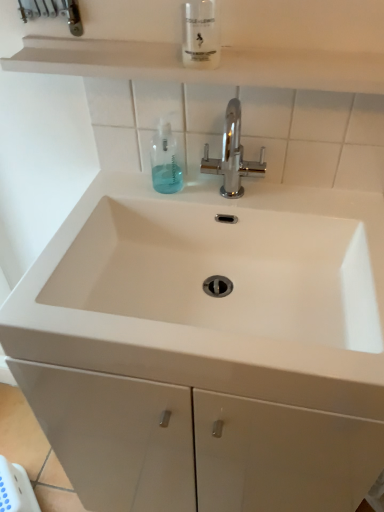
Question: Would you say chrome metallic faucet at center is outside clear plastic bottle at upper center, the second mouthwash viewed from the left?

Choices:
 (A) no
 (B) yes

Answer: (B)

Question: Considering the relative sizes of chrome metallic faucet at center and clear plastic bottle at upper center, the 2th mouthwash positioned from the back, in the image provided, is chrome metallic faucet at center smaller than clear plastic bottle at upper center, the 2th mouthwash positioned from the back,?

Choices:
 (A) yes
 (B) no

Answer: (B)

Question: Could you tell me if chrome metallic faucet at center is facing clear plastic bottle at upper center, which is the 2th mouthwash from bottom to top?

Choices:
 (A) no
 (B) yes

Answer: (A)

Question: Considering the relative sizes of chrome metallic faucet at center and clear plastic bottle at upper center, which is the 2th mouthwash from bottom to top, in the image provided, is chrome metallic faucet at center bigger than clear plastic bottle at upper center, which is the 2th mouthwash from bottom to top,?

Choices:
 (A) yes
 (B) no

Answer: (A)

Question: Does chrome metallic faucet at center appear on the left side of clear plastic bottle at upper center, which is the first mouthwash from top to bottom?

Choices:
 (A) no
 (B) yes

Answer: (A)

Question: Considering the positions of point tap(230, 136) and point tap(195, 14), is point tap(230, 136) closer or farther from the camera than point tap(195, 14)?

Choices:
 (A) farther
 (B) closer

Answer: (A)

Question: Choose the correct answer: Is chrome metallic faucet at center inside clear plastic bottle at upper center, the second mouthwash viewed from the left, or outside it?

Choices:
 (A) outside
 (B) inside

Answer: (A)

Question: Is chrome metallic faucet at center wider or thinner than clear plastic bottle at upper center, which is the first mouthwash from top to bottom?

Choices:
 (A) wide
 (B) thin

Answer: (A)

Question: From the image's perspective, relative to clear plastic bottle at upper center, which is the first mouthwash from top to bottom, is chrome metallic faucet at center above or below?

Choices:
 (A) below
 (B) above

Answer: (A)

Question: Is white matte shelf at upper center inside the boundaries of translucent plastic mouthwash at center, positioned as the second mouthwash in front-to-back order, or outside?

Choices:
 (A) inside
 (B) outside

Answer: (B)

Question: Looking at their shapes, would you say white matte shelf at upper center is wider or thinner than translucent plastic mouthwash at center, acting as the 1th mouthwash starting from the left?

Choices:
 (A) wide
 (B) thin

Answer: (A)

Question: Does point (46, 68) appear closer or farther from the camera than point (165, 175)?

Choices:
 (A) closer
 (B) farther

Answer: (A)

Question: Looking at the image, does white matte shelf at upper center seem bigger or smaller compared to translucent plastic mouthwash at center, which is counted as the 2th mouthwash, starting from the right?

Choices:
 (A) big
 (B) small

Answer: (A)

Question: Is translucent plastic mouthwash at center, acting as the 1th mouthwash starting from the left, bigger or smaller than clear plastic bottle at upper center, which is the 1th mouthwash in right-to-left order?

Choices:
 (A) small
 (B) big

Answer: (A)

Question: Considering the relative positions of translucent plastic mouthwash at center, which is counted as the 2th mouthwash, starting from the right, and clear plastic bottle at upper center, which is the first mouthwash from top to bottom, in the image provided, is translucent plastic mouthwash at center, which is counted as the 2th mouthwash, starting from the right, to the left or to the right of clear plastic bottle at upper center, which is the first mouthwash from top to bottom,?

Choices:
 (A) left
 (B) right

Answer: (A)